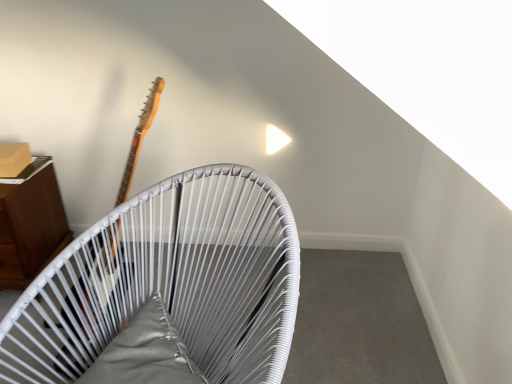
Question: In which direction should I rotate to look at white woven chair at upper center, which ranks as the first furniture in right-to-left order?

Choices:
 (A) left
 (B) right

Answer: (A)

Question: From the image's perspective, is wooden cabinet at left, marked as the second furniture in a right-to-left arrangement, on white woven chair at upper center, which is counted as the 2th furniture, starting from the left?

Choices:
 (A) no
 (B) yes

Answer: (B)

Question: Would you say wooden cabinet at left, marked as the second furniture in a right-to-left arrangement, is outside white woven chair at upper center, which ranks as the first furniture in right-to-left order?

Choices:
 (A) no
 (B) yes

Answer: (B)

Question: Does wooden cabinet at left, marked as the second furniture in a right-to-left arrangement, have a lesser width compared to white woven chair at upper center, which ranks as the first furniture in right-to-left order?

Choices:
 (A) yes
 (B) no

Answer: (A)

Question: Does wooden cabinet at left, which is counted as the first furniture, starting from the left, lie behind white woven chair at upper center, which is counted as the second furniture, starting from the back?

Choices:
 (A) yes
 (B) no

Answer: (A)

Question: Does wooden cabinet at left, which is counted as the first furniture, starting from the left, have a greater height compared to white woven chair at upper center, marked as the first furniture in a front-to-back arrangement?

Choices:
 (A) yes
 (B) no

Answer: (B)

Question: Is wooden cabinet at left, marked as the second furniture in a right-to-left arrangement, not near white woven chair at upper center, which is counted as the 2th furniture, starting from the left?

Choices:
 (A) no
 (B) yes

Answer: (A)

Question: Is wooden guitar at left outside of white woven chair at upper center, which is counted as the second furniture, starting from the back?

Choices:
 (A) yes
 (B) no

Answer: (A)

Question: Is wooden guitar at left oriented towards white woven chair at upper center, which is counted as the second furniture, starting from the back?

Choices:
 (A) no
 (B) yes

Answer: (A)

Question: Considering the relative sizes of wooden guitar at left and white woven chair at upper center, which is counted as the second furniture, starting from the back, in the image provided, is wooden guitar at left wider than white woven chair at upper center, which is counted as the second furniture, starting from the back,?

Choices:
 (A) yes
 (B) no

Answer: (B)

Question: Is wooden guitar at left positioned far away from white woven chair at upper center, which is counted as the second furniture, starting from the back?

Choices:
 (A) yes
 (B) no

Answer: (B)

Question: From the image's perspective, does wooden guitar at left appear lower than white woven chair at upper center, marked as the first furniture in a front-to-back arrangement?

Choices:
 (A) no
 (B) yes

Answer: (A)

Question: Considering the relative positions of wooden guitar at left and white woven chair at upper center, which ranks as the first furniture in right-to-left order, in the image provided, is wooden guitar at left behind white woven chair at upper center, which ranks as the first furniture in right-to-left order,?

Choices:
 (A) no
 (B) yes

Answer: (B)

Question: From a real-world perspective, is wooden cabinet at left, marked as the second furniture in a right-to-left arrangement, located higher than wooden guitar at left?

Choices:
 (A) yes
 (B) no

Answer: (B)